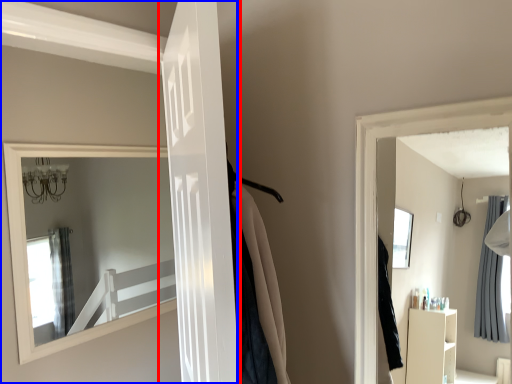
Question: Which object is further to the camera taking this photo, door (highlighted by a red box) or door (highlighted by a blue box)?

Choices:
 (A) door
 (B) door

Answer: (B)